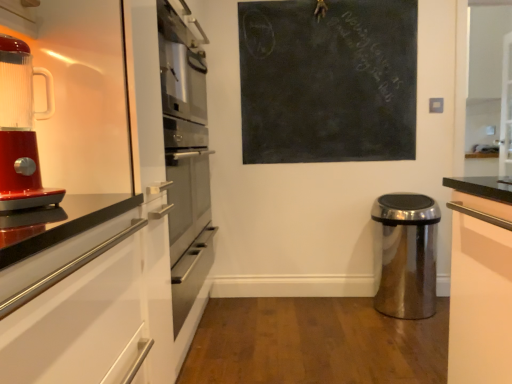
Question: Is black chalkboard at upper center facing towards shiny red blender at left?

Choices:
 (A) yes
 (B) no

Answer: (A)

Question: From a real-world perspective, is black chalkboard at upper center positioned over shiny red blender at left based on gravity?

Choices:
 (A) no
 (B) yes

Answer: (B)

Question: Is black chalkboard at upper center shorter than shiny red blender at left?

Choices:
 (A) yes
 (B) no

Answer: (B)

Question: From the image's perspective, is black chalkboard at upper center located above shiny red blender at left?

Choices:
 (A) yes
 (B) no

Answer: (A)

Question: Considering the relative sizes of black chalkboard at upper center and shiny red blender at left in the image provided, is black chalkboard at upper center bigger than shiny red blender at left?

Choices:
 (A) no
 (B) yes

Answer: (B)

Question: Is polished stainless steel trash can at lower right taller or shorter than black chalkboard at upper center?

Choices:
 (A) short
 (B) tall

Answer: (A)

Question: Does point (379, 208) appear closer or farther from the camera than point (396, 110)?

Choices:
 (A) closer
 (B) farther

Answer: (A)

Question: Based on their sizes in the image, would you say polished stainless steel trash can at lower right is bigger or smaller than black chalkboard at upper center?

Choices:
 (A) big
 (B) small

Answer: (A)

Question: Do you think polished stainless steel trash can at lower right is within black chalkboard at upper center, or outside of it?

Choices:
 (A) inside
 (B) outside

Answer: (B)

Question: Considering the relative positions of polished stainless steel trash can at lower right and shiny red blender at left in the image provided, is polished stainless steel trash can at lower right to the left or to the right of shiny red blender at left?

Choices:
 (A) left
 (B) right

Answer: (B)

Question: In terms of size, does polished stainless steel trash can at lower right appear bigger or smaller than shiny red blender at left?

Choices:
 (A) small
 (B) big

Answer: (B)

Question: Is polished stainless steel trash can at lower right wider or thinner than shiny red blender at left?

Choices:
 (A) wide
 (B) thin

Answer: (A)

Question: From a real-world perspective, is polished stainless steel trash can at lower right physically located above or below shiny red blender at left?

Choices:
 (A) below
 (B) above

Answer: (A)

Question: Considering the relative positions of black chalkboard at upper center and polished stainless steel trash can at lower right in the image provided, is black chalkboard at upper center to the left or to the right of polished stainless steel trash can at lower right?

Choices:
 (A) right
 (B) left

Answer: (B)

Question: Based on their sizes in the image, would you say black chalkboard at upper center is bigger or smaller than polished stainless steel trash can at lower right?

Choices:
 (A) small
 (B) big

Answer: (A)